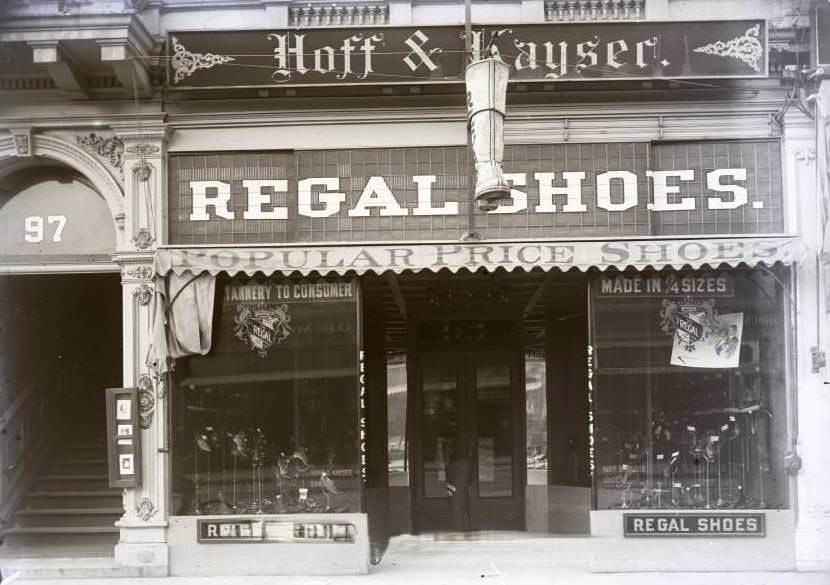
Identify the location of stairs. The height and width of the screenshot is (585, 830). (74, 498).